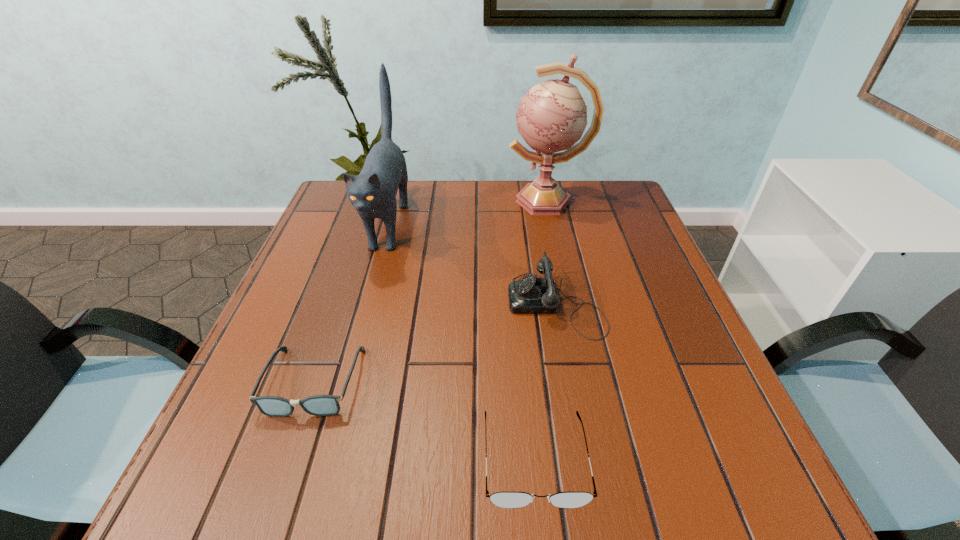
Identify the location of blank area at the far edge. The image size is (960, 540). (425, 208).

Identify the location of vacant region at the left edge. This screenshot has width=960, height=540. (288, 298).

In the image, there is a desktop. Identify the location of free space at the right edge. (700, 418).

In order to click on vacant space at the far left corner in this screenshot , I will do `click(329, 209)`.

Image resolution: width=960 pixels, height=540 pixels. I want to click on vacant space at the far right corner of the desktop, so click(x=633, y=203).

Where is `vacant space at the near right corner of the desktop`? The width and height of the screenshot is (960, 540). vacant space at the near right corner of the desktop is located at coordinates (740, 456).

This screenshot has width=960, height=540. What are the coordinates of `vacant space that is in between the globe and the left spectacles` in the screenshot? It's located at (430, 292).

You are a GUI agent. You are given a task and a screenshot of the screen. Output one action in this format:
    pyautogui.click(x=<x>, y=<y>)
    Task: Click on the vacant region between the cat and the left spectacles
    The image size is (960, 540).
    Given the screenshot: What is the action you would take?
    pyautogui.click(x=351, y=303)

The width and height of the screenshot is (960, 540). What are the coordinates of `free point between the left spectacles and the globe` in the screenshot? It's located at (430, 292).

Identify the location of vacant space in between the globe and the telephone. The image size is (960, 540). (551, 252).